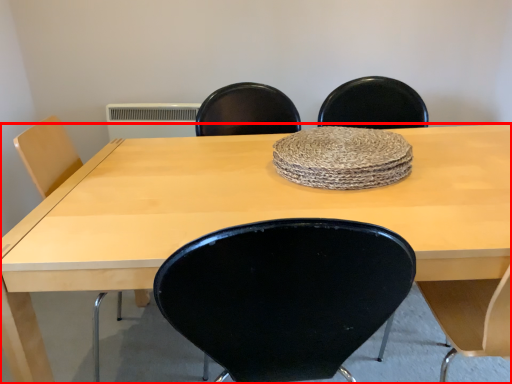
Question: Considering the relative positions of table (annotated by the red box) and mat in the image provided, where is table (annotated by the red box) located with respect to the staircase?

Choices:
 (A) right
 (B) left

Answer: (B)